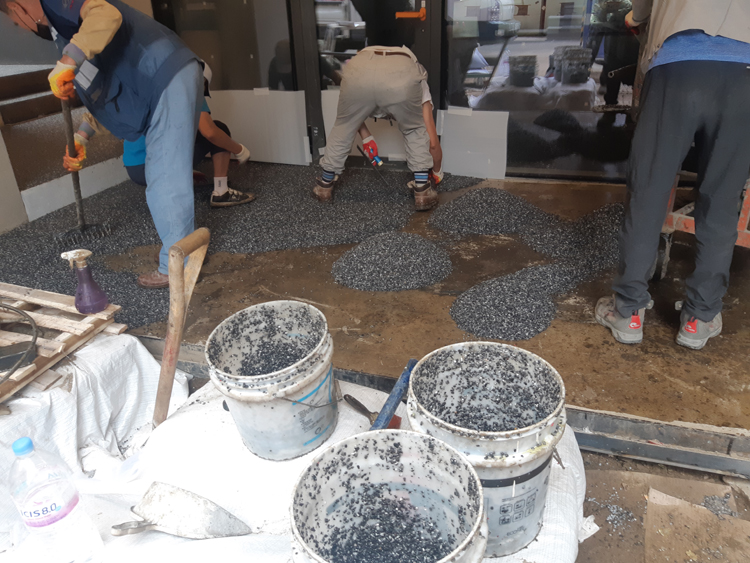
This screenshot has width=750, height=563. I want to click on bucket, so (310, 419).